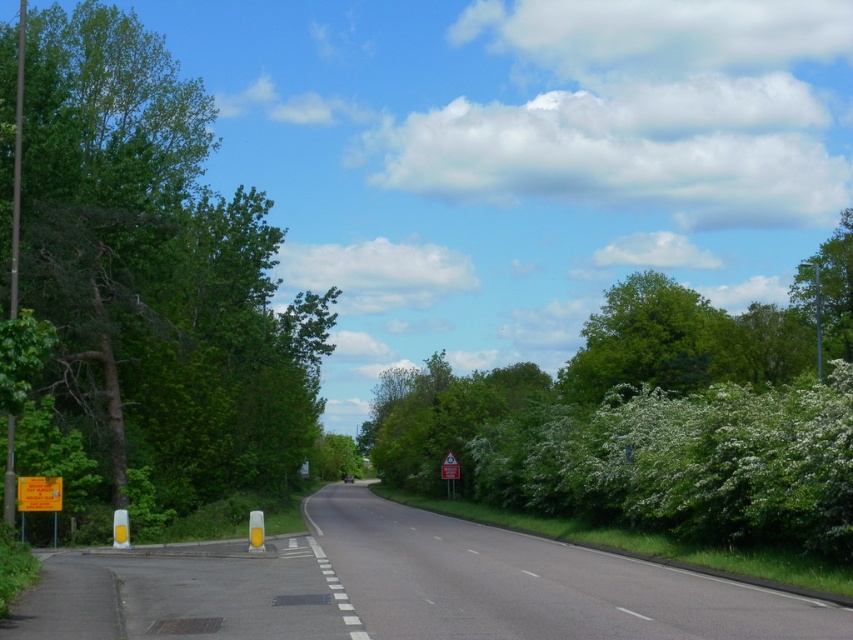
Question: Estimate the real-world distances between objects in this image. Which object is closer to the asphalt road at center?

Choices:
 (A) green leafy tree at left
 (B) metallic reflective triangular sign at center
 (C) green leafy tree at center
 (D) green leafy tree at upper right

Answer: (A)

Question: Which object is positioned farthest from the green leafy tree at center?

Choices:
 (A) green leafy tree at upper right
 (B) green leafy tree at left

Answer: (A)

Question: Is asphalt road at center wider than green leafy tree at upper right?

Choices:
 (A) no
 (B) yes

Answer: (A)

Question: Which of the following is the farthest from the observer?

Choices:
 (A) green leafy tree at upper right
 (B) green leafy tree at center
 (C) asphalt road at center

Answer: (A)

Question: Is green leafy tree at left below green leafy tree at upper right?

Choices:
 (A) no
 (B) yes

Answer: (A)

Question: Does green leafy tree at left appear on the right side of asphalt road at center?

Choices:
 (A) no
 (B) yes

Answer: (A)